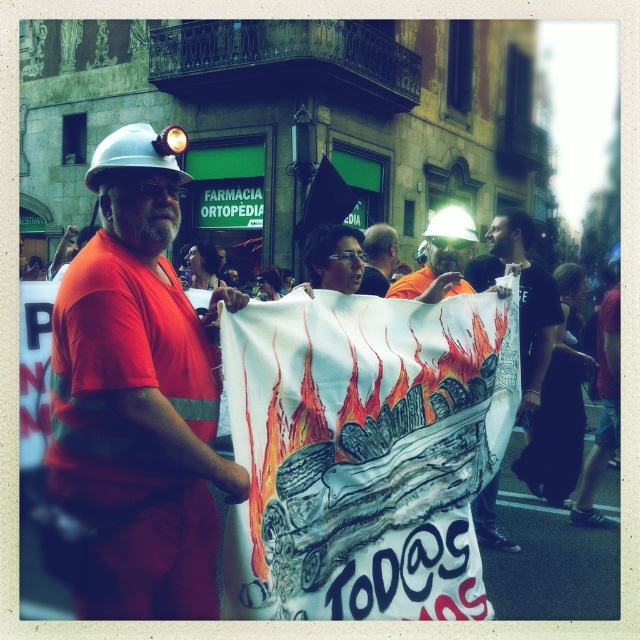
You are a drone operator trying to capture a clear image of the banner held by the protesters. You notice two points marked on your screen at coordinates point [458,256] and point [390,234]. Which point should you focus on to ensure the banner is in focus?

You should focus on point [458,256] because it is in front of point [390,234]. Since the banner is in the foreground, focusing on the closer point will ensure the banner appears sharp in the image.

You are a photographer trying to capture a clear shot of the matte orange jumpsuit at center and the matte white helmet at center. Since you want the jumpsuit to appear more prominent in the photo, which object should you zoom in on and why?

The matte orange jumpsuit at center is thinner than the matte white helmet at center. To make the jumpsuit appear more prominent, you should zoom in on the matte orange jumpsuit at center because its thinner profile requires closer focus to emphasize its details compared to the wider matte white helmet at center.

You are a drone operator tasked with capturing aerial footage of the protest scene. You need to ensure both the matte orange jumpsuit at center and the matte white helmet at center are clearly visible in the shot. Given their distance apart, what is the minimum width of the camera frame required to capture both objects simultaneously?

The matte orange jumpsuit at center and the matte white helmet at center are 2.78 meters apart from each other. To capture both in the same frame, the camera frame must be at least 2.78 meters wide.